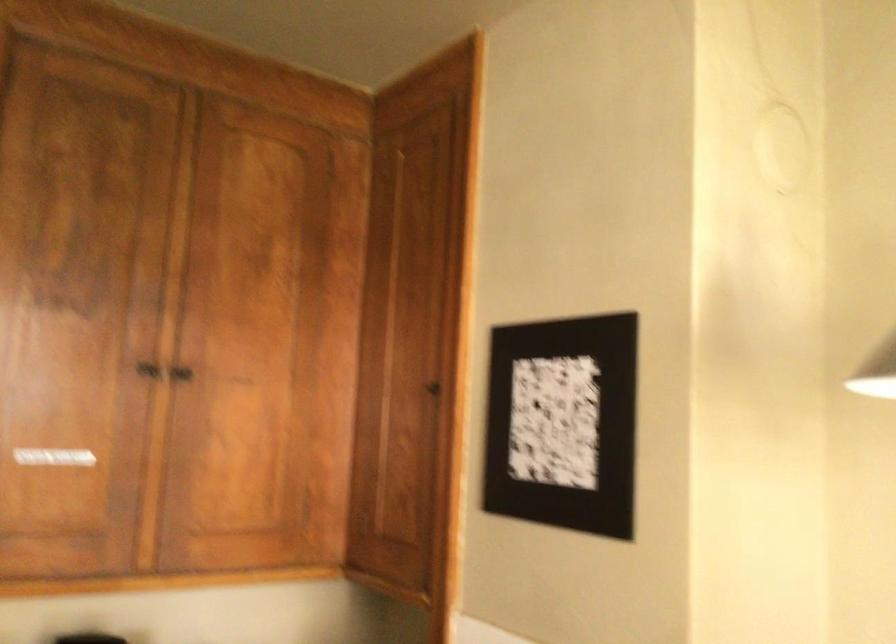
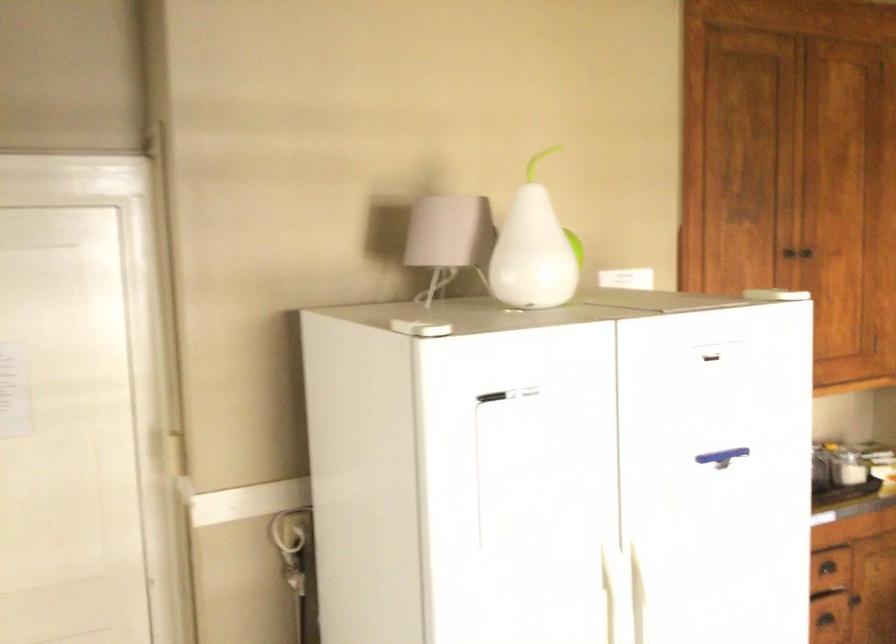
In the second image, find the point that corresponds to pixel 133 360 in the first image.

(786, 257)